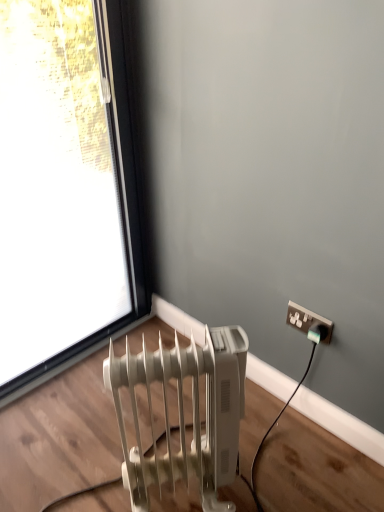
I want to click on free space to the left of white plastic radiator at lower left, so click(89, 472).